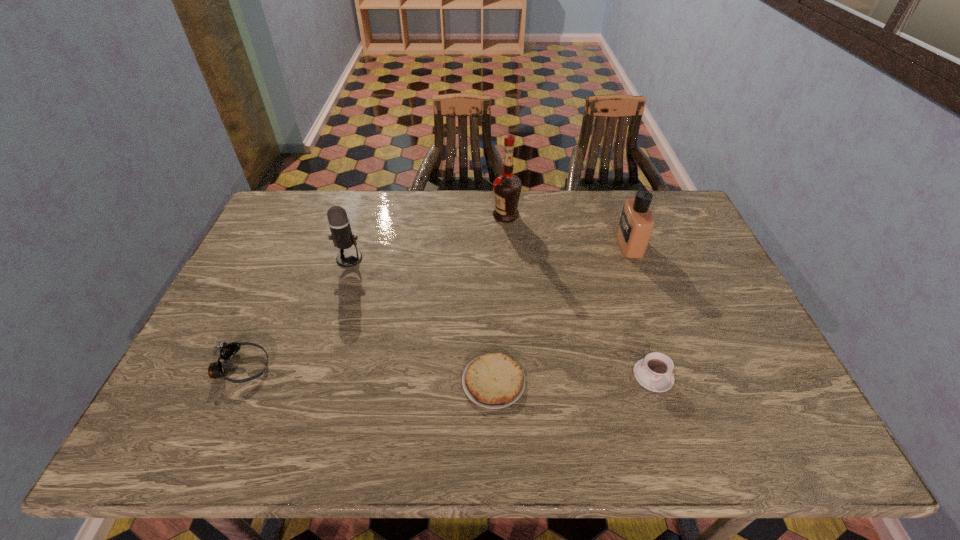
The image size is (960, 540). Find the location of `unoccupied area between the shortest object and the microphone`. unoccupied area between the shortest object and the microphone is located at coordinates (421, 320).

Where is `vacant area that lies between the tallest object and the perfume`? The width and height of the screenshot is (960, 540). vacant area that lies between the tallest object and the perfume is located at coordinates (567, 230).

Locate an element on the screen. vacant space in between the perfume and the microphone is located at coordinates (490, 251).

Where is `vacant area that lies between the microphone and the farthest object`? The width and height of the screenshot is (960, 540). vacant area that lies between the microphone and the farthest object is located at coordinates (428, 237).

In order to click on vacant point located between the perfume and the leftmost object in this screenshot , I will do `click(436, 306)`.

Locate an element on the screen. This screenshot has height=540, width=960. free area in between the tortilla and the perfume is located at coordinates (562, 313).

Locate an element on the screen. The image size is (960, 540). the fourth closest object to the microphone is located at coordinates (654, 372).

Where is `object that is the closest one to the perfume`? Image resolution: width=960 pixels, height=540 pixels. object that is the closest one to the perfume is located at coordinates (507, 187).

This screenshot has height=540, width=960. What are the coordinates of `free point that satisfies the following two spatial constraints: 1. on the front and back of the farthest object; 2. on the front side of the second object from left to right` in the screenshot? It's located at (509, 259).

The image size is (960, 540). I want to click on free space that satisfies the following two spatial constraints: 1. on the front side of the fifth object from right to left; 2. through the lenses of the leftmost object, so click(x=317, y=367).